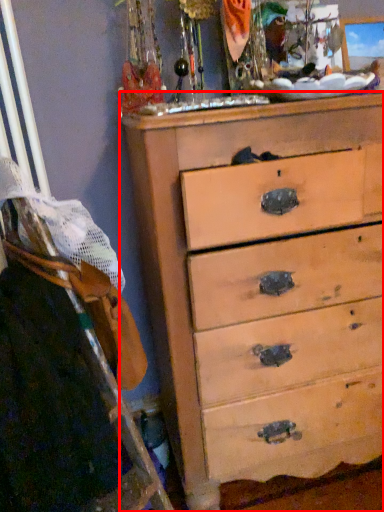
Question: From the image's perspective, what is the correct spatial relationship of chest of drawers (annotated by the red box) in relation to ladder?

Choices:
 (A) above
 (B) below

Answer: (A)